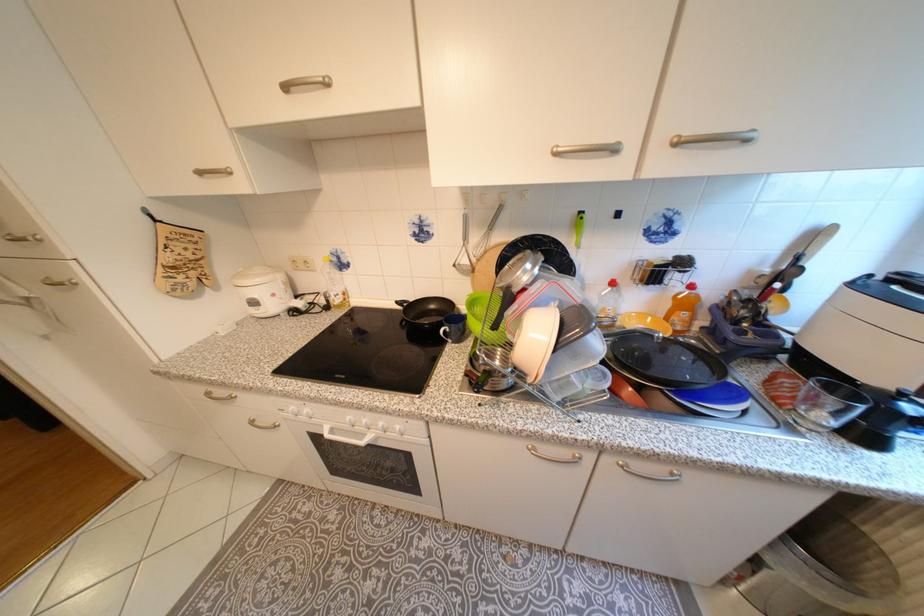
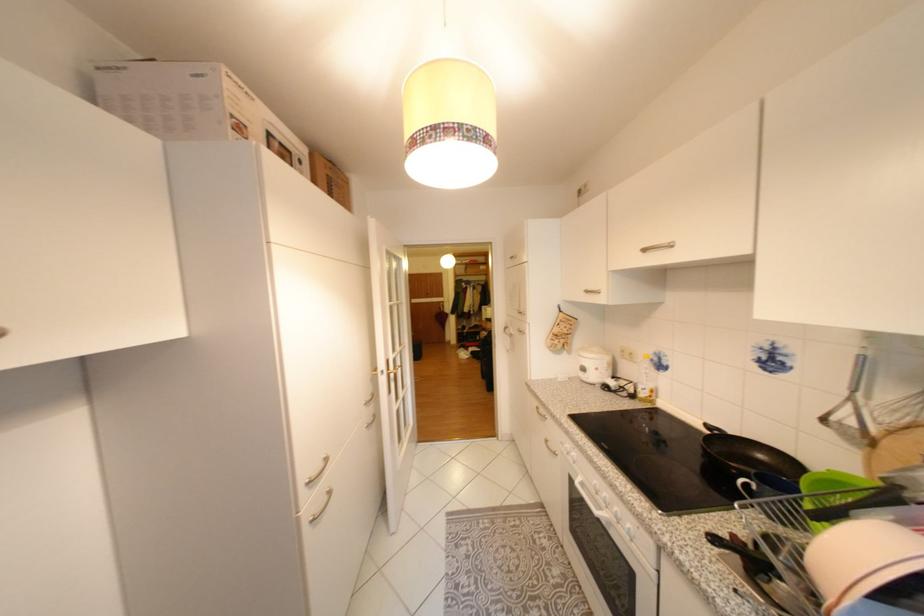
Locate, in the second image, the point that corresponds to point 407,302 in the first image.

(715, 426)